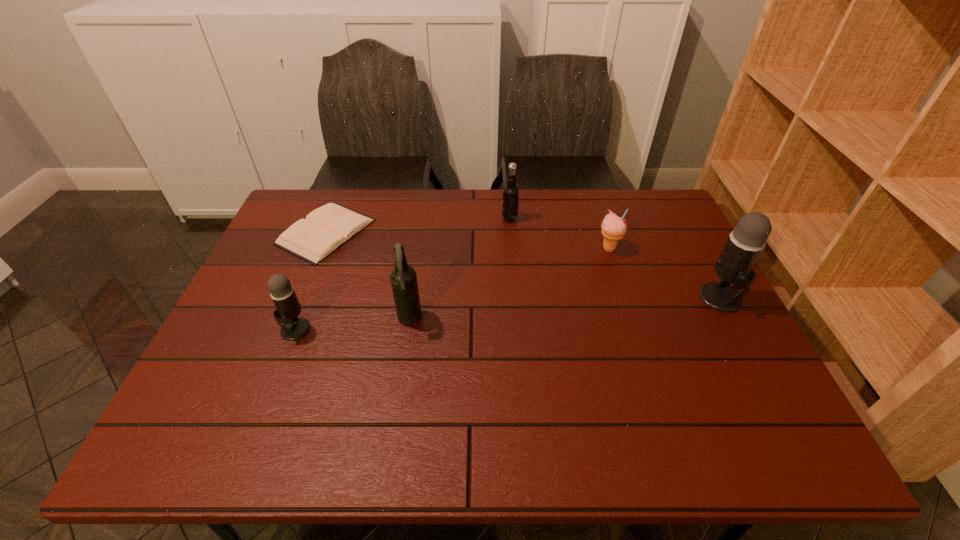
Where is `unoccupied position between the fifth tallest object and the beer bottle`? unoccupied position between the fifth tallest object and the beer bottle is located at coordinates (509, 285).

You are a GUI agent. You are given a task and a screenshot of the screen. Output one action in this format:
    pyautogui.click(x=<x>, y=<y>)
    Task: Click on the empty location between the taller microphone and the shortest object
    The image size is (960, 540).
    Given the screenshot: What is the action you would take?
    pyautogui.click(x=523, y=265)

Identify the location of free space between the farther microphone and the beer bottle. Image resolution: width=960 pixels, height=540 pixels. (565, 309).

Locate an element on the screen. This screenshot has width=960, height=540. free space between the hardback book and the beer bottle is located at coordinates (368, 276).

Locate an element on the screen. This screenshot has width=960, height=540. free area in between the shortest object and the fifth object from left to right is located at coordinates (468, 240).

You are a GUI agent. You are given a task and a screenshot of the screen. Output one action in this format:
    pyautogui.click(x=<x>, y=<y>)
    Task: Click on the vacant space that's between the shortest object and the left microphone
    This screenshot has width=960, height=540.
    Given the screenshot: What is the action you would take?
    pyautogui.click(x=311, y=280)

Identify which object is the nearest to the third object from right to left. Please provide its 2D coordinates. Your answer should be formatted as a tuple, i.e. [(x, y)], where the tuple contains the x and y coordinates of a point satisfying the conditions above.

[(614, 228)]

Locate an element on the screen. This screenshot has height=540, width=960. the fifth closest object to the shortest object is located at coordinates (745, 243).

Locate an element on the screen. This screenshot has width=960, height=540. free space that satisfies the following two spatial constraints: 1. on the back side of the second object from right to left; 2. on the label of the root beer is located at coordinates (599, 219).

The image size is (960, 540). I want to click on vacant space that satisfies the following two spatial constraints: 1. on the back side of the icecream; 2. on the label of the root beer, so click(599, 219).